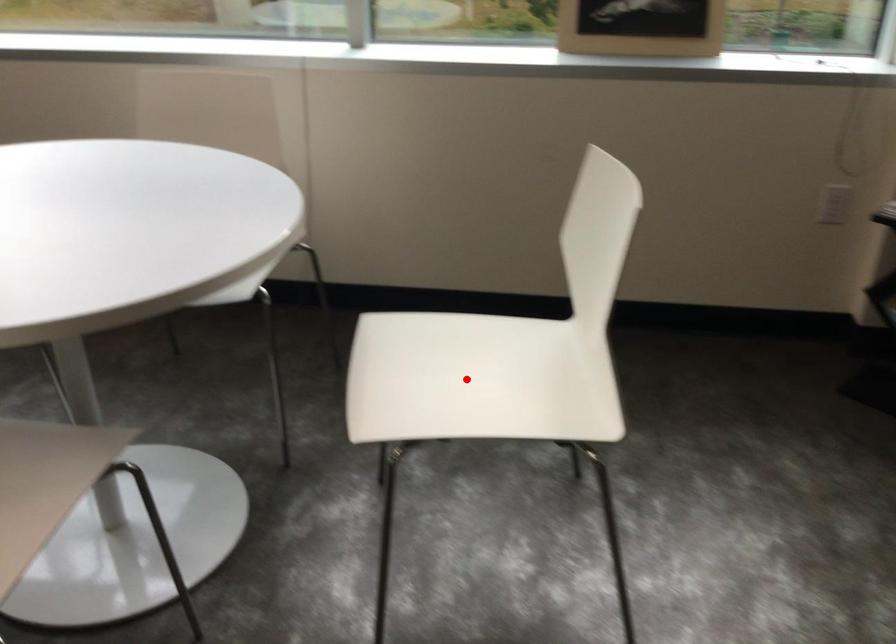
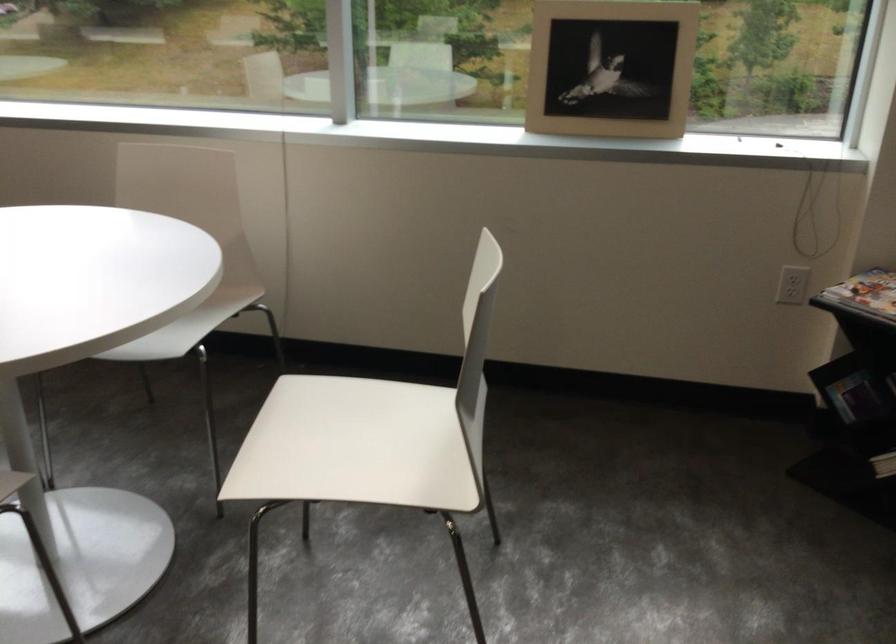
Where in the second image is the point corresponding to the highlighted location from the first image?

(356, 446)